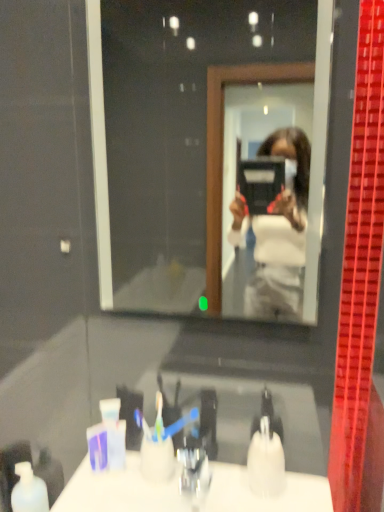
Where is `unoccupied region to the right of translucent plastic soap dispenser at lower center`? unoccupied region to the right of translucent plastic soap dispenser at lower center is located at coordinates (299, 495).